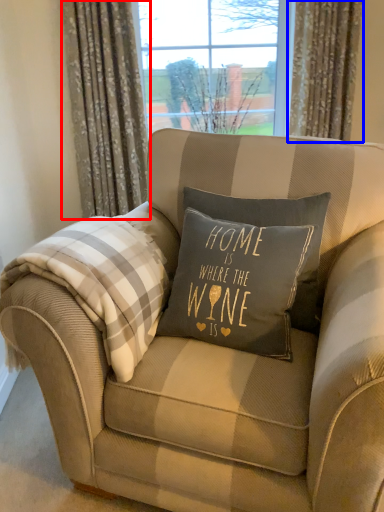
Question: Which of the following is the closest to the observer, curtain (highlighted by a red box) or curtain (highlighted by a blue box)?

Choices:
 (A) curtain
 (B) curtain

Answer: (A)